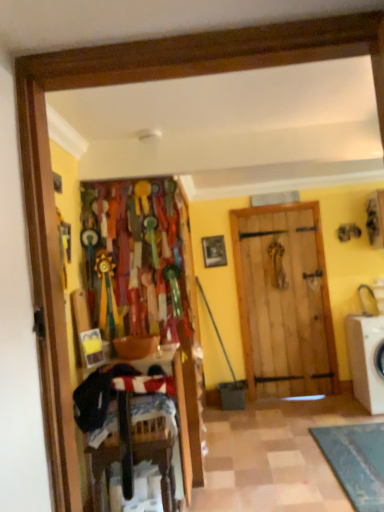
Question: From the image's perspective, is wooden picture frame at center positioned above or below white plastic washing machine at right?

Choices:
 (A) below
 (B) above

Answer: (B)

Question: Is wooden picture frame at center spatially inside white plastic washing machine at right, or outside of it?

Choices:
 (A) inside
 (B) outside

Answer: (B)

Question: Which object is positioned closest to the white plastic washing machine at right?

Choices:
 (A) wooden picture frame at center
 (B) dark blue fabric laundry at lower left

Answer: (A)

Question: Estimate the real-world distances between objects in this image. Which object is closer to the white plastic washing machine at right?

Choices:
 (A) wooden picture frame at center
 (B) dark blue fabric laundry at lower left

Answer: (A)